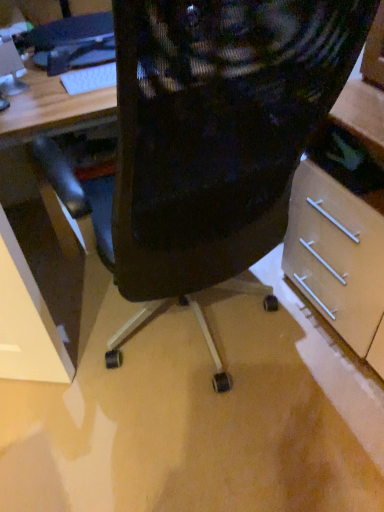
Question: Considering the relative positions of black mesh chair at center and matte black monitor at upper left in the image provided, is black mesh chair at center to the left or to the right of matte black monitor at upper left?

Choices:
 (A) left
 (B) right

Answer: (B)

Question: Is point (140, 11) closer or farther from the camera than point (11, 74)?

Choices:
 (A) closer
 (B) farther

Answer: (A)

Question: Estimate the real-world distances between objects in this image. Which object is farther from the black mesh chair at center?

Choices:
 (A) black plastic keyboard at upper left
 (B) white plastic keyboard at upper left
 (C) matte black monitor at upper left

Answer: (C)

Question: Which object is the closest to the black plastic keyboard at upper left?

Choices:
 (A) white plastic keyboard at upper left
 (B) black mesh chair at center
 (C) matte black monitor at upper left

Answer: (A)